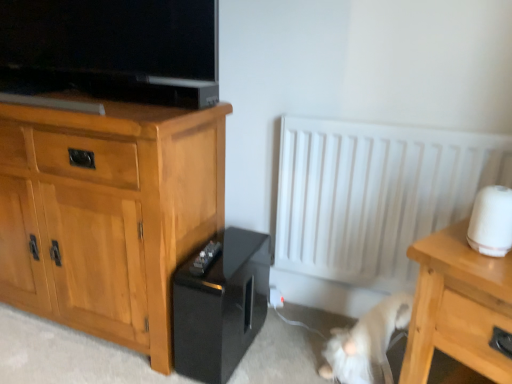
Question: Do you think light wood cabinet at left is within white matte radiator at center, or outside of it?

Choices:
 (A) inside
 (B) outside

Answer: (B)

Question: From a real-world perspective, is light wood cabinet at left above or below white matte radiator at center?

Choices:
 (A) below
 (B) above

Answer: (A)

Question: Estimate the real-world distances between objects in this image. Which object is farther from the light wood/texture nightstand at lower right?

Choices:
 (A) black glossy amplifier at lower center
 (B) light wood cabinet at left
 (C) white fur cat at lower right
 (D) white matte radiator at center

Answer: (B)

Question: Which of these objects is positioned closest to the light wood/texture nightstand at lower right?

Choices:
 (A) white matte radiator at center
 (B) white fur cat at lower right
 (C) black glossy amplifier at lower center
 (D) light wood cabinet at left

Answer: (B)